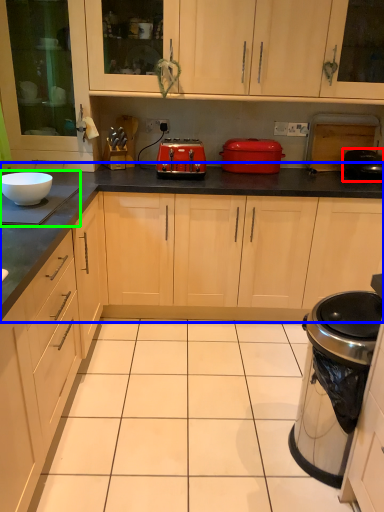
Question: Which object is the closest to the appliance (highlighted by a red box)? Choose among these: countertop (highlighted by a blue box) or appliance (highlighted by a green box).

Choices:
 (A) countertop
 (B) appliance

Answer: (A)